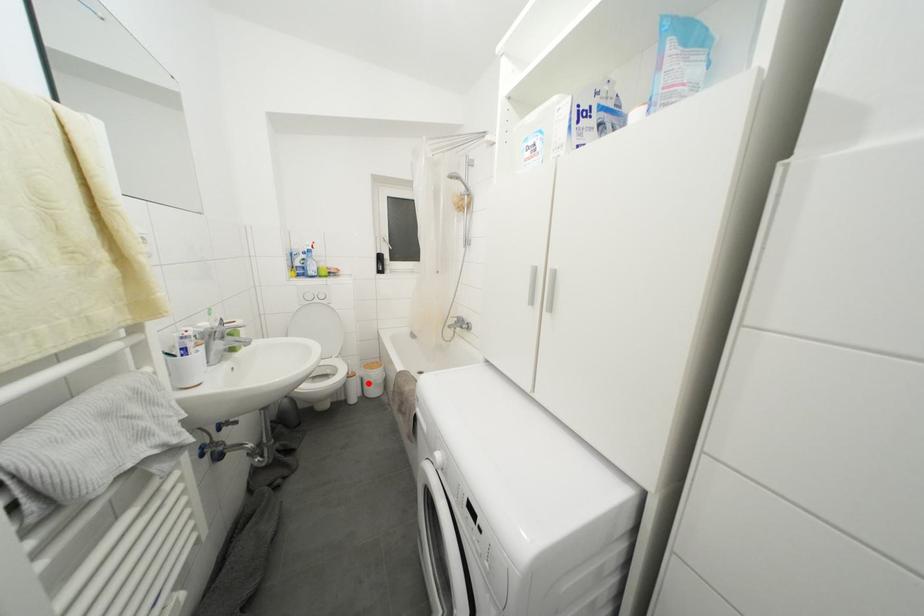
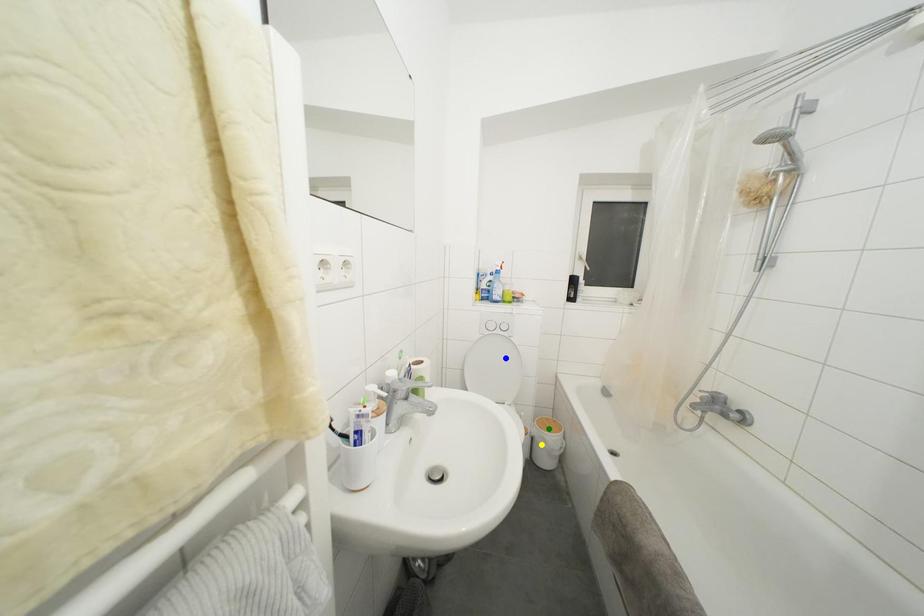
Question: I am providing you with two images of the same scene from different viewpoints. A red point is marked on the first image. You are given multiple points on the second image. Which point in image 2 represents the same 3d spot as the red point in image 1?

Choices:
 (A) green point
 (B) yellow point
 (C) blue point

Answer: (B)